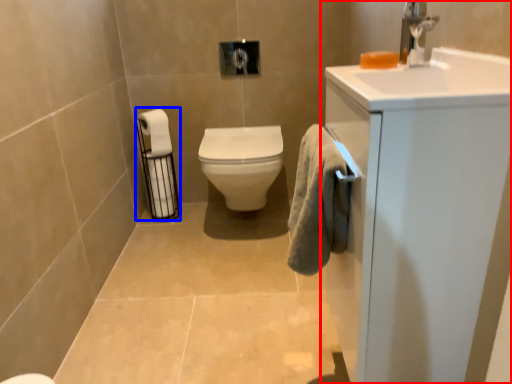
Question: Which of the following is the closest to the observer, bathroom cabinet (highlighted by a red box) or toilet paper (highlighted by a blue box)?

Choices:
 (A) bathroom cabinet
 (B) toilet paper

Answer: (A)